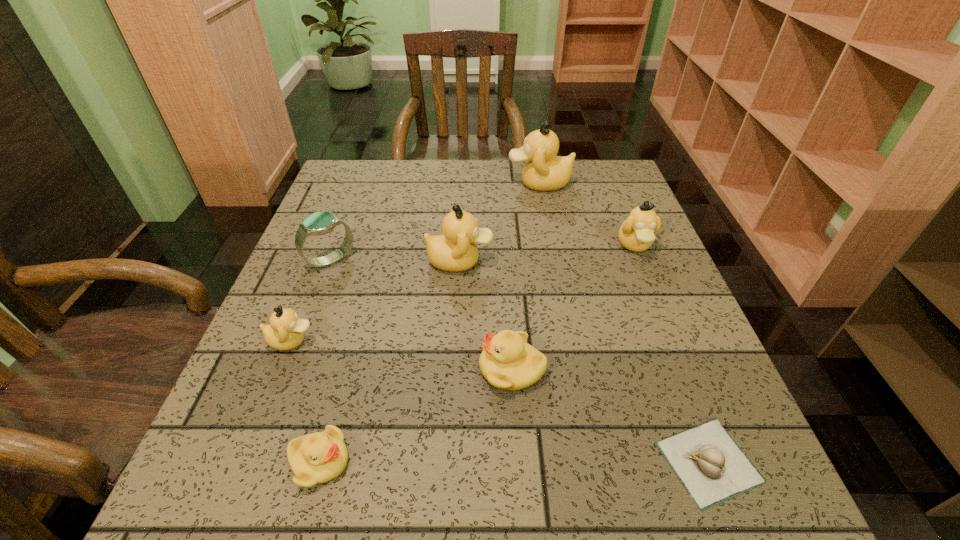
Find the location of `the tallest duckling`. the tallest duckling is located at coordinates (544, 171).

Locate an element on the screen. Image resolution: width=960 pixels, height=540 pixels. the farthest tan duckling is located at coordinates (544, 171).

Where is `the seventh shortest object`? the seventh shortest object is located at coordinates (455, 250).

The height and width of the screenshot is (540, 960). What are the coordinates of `the third smallest tan duckling` in the screenshot? It's located at (455, 250).

Find the location of a particular element. the rightmost duckling is located at coordinates (636, 233).

The image size is (960, 540). I want to click on the rightmost tan duckling, so click(636, 233).

The image size is (960, 540). Find the location of `blue watch`. blue watch is located at coordinates (319, 223).

You are a GUI agent. You are given a task and a screenshot of the screen. Output one action in this format:
    pyautogui.click(x=<x>, y=<y>)
    Task: Click on the leftmost duckling
    
    Given the screenshot: What is the action you would take?
    [286, 331]

Find the location of a particular element. This screenshot has width=960, height=540. the smallest tan duckling is located at coordinates (286, 331).

The image size is (960, 540). In order to click on the farther yellow duckling in this screenshot , I will do `click(507, 361)`.